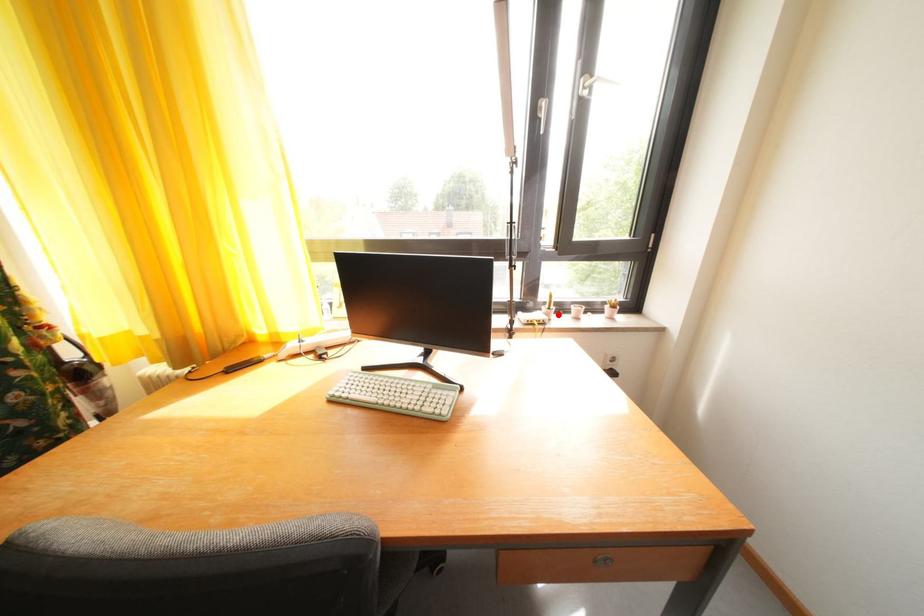
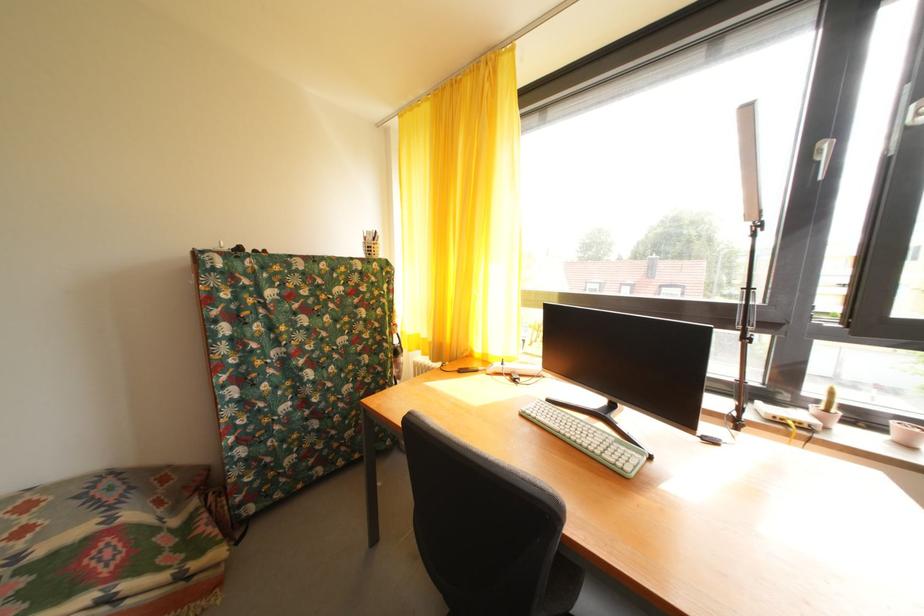
The point at the highlighted location is marked in the first image. Where is the corresponding point in the second image?

(836, 416)